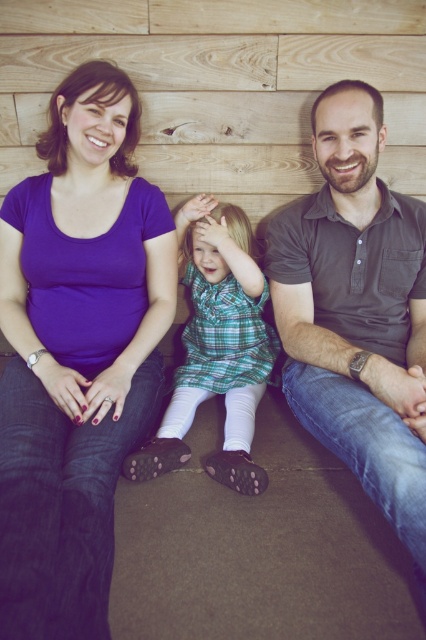
You are a photographer trying to capture a group photo of the dark gray polo shirt at right and the green plaid dress at center. Which clothing item should you focus on first if you want to ensure both are in frame without moving the camera?

The dark gray polo shirt at right is larger in size than the green plaid dress at center, so you should focus on the dark gray polo shirt at right first to ensure both are in frame without moving the camera.